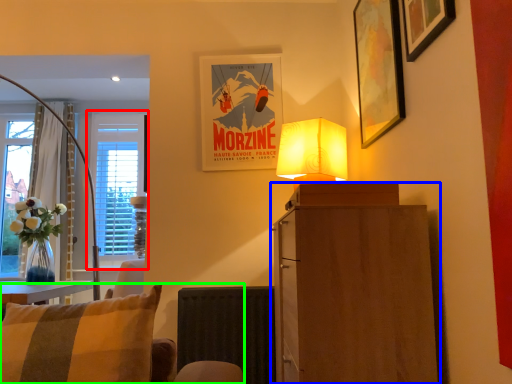
Question: Which object is the closest to the window (highlighted by a red box)? Choose among these: cabinetry (highlighted by a blue box) or chair (highlighted by a green box).

Choices:
 (A) cabinetry
 (B) chair

Answer: (B)